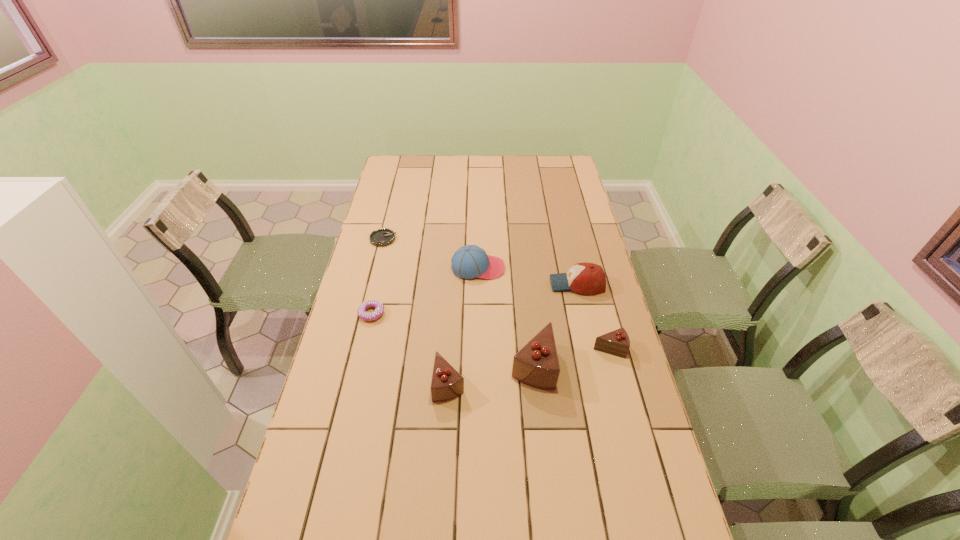
The width and height of the screenshot is (960, 540). Identify the location of doughnut located in the left edge section of the desktop. (379, 307).

Identify the location of ashtray that is at the left edge. This screenshot has height=540, width=960. (382, 237).

Locate an element on the screen. Image resolution: width=960 pixels, height=540 pixels. chocolate cake at the right edge is located at coordinates (617, 342).

This screenshot has height=540, width=960. I want to click on baseball cap present at the right edge, so click(x=585, y=278).

In the image, there is a desktop. Identify the location of vacant space at the far edge. This screenshot has width=960, height=540. (493, 181).

The height and width of the screenshot is (540, 960). In the image, there is a desktop. What are the coordinates of `vacant space at the left edge` in the screenshot? It's located at (412, 191).

In the image, there is a desktop. Where is `vacant space at the right edge`? The image size is (960, 540). vacant space at the right edge is located at coordinates (580, 249).

Image resolution: width=960 pixels, height=540 pixels. In order to click on vacant space at the far left corner of the desktop in this screenshot , I will do `click(401, 172)`.

Locate an element on the screen. free space at the far right corner of the desktop is located at coordinates (555, 177).

Image resolution: width=960 pixels, height=540 pixels. Identify the location of vacant space in between the doughnut and the second shortest chocolate cake. (410, 348).